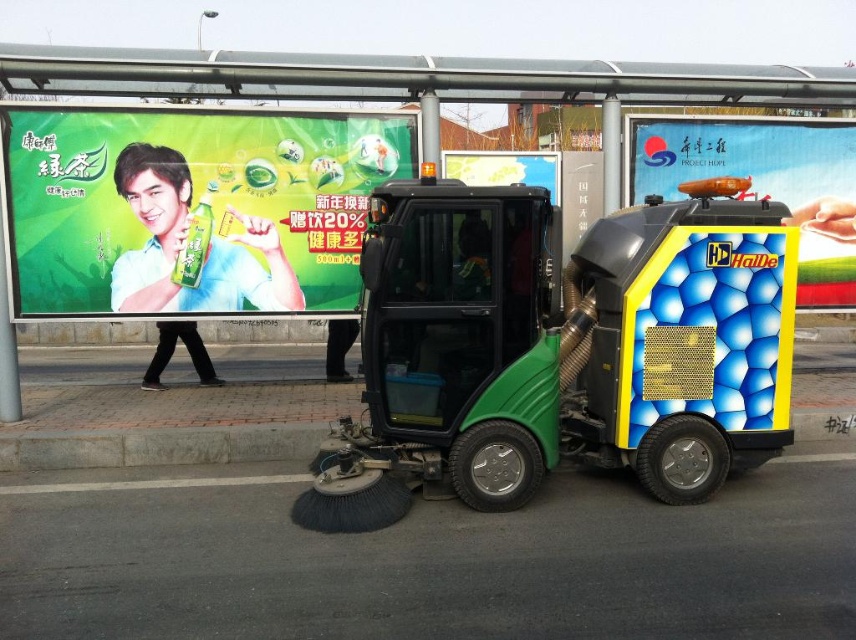
Is green matte bottle at upper left in front of yellow metallic billboard at center?

That is True.

Who is shorter, green matte bottle at upper left or yellow metallic billboard at center?

With less height is yellow metallic billboard at center.

Is point (152, 144) less distant than point (539, 157)?

Yes, it is in front of point (539, 157).

Where is `green matte bottle at upper left`? Image resolution: width=856 pixels, height=640 pixels. green matte bottle at upper left is located at coordinates (192, 205).

Which is below, green matte street sweeper at center or green matte bottle at upper left?

green matte street sweeper at center is below.

Is green matte street sweeper at center positioned in front of green matte bottle at upper left?

Yes.

What do you see at coordinates (563, 344) in the screenshot?
I see `green matte street sweeper at center` at bounding box center [563, 344].

Where is `green matte street sweeper at center`? The height and width of the screenshot is (640, 856). green matte street sweeper at center is located at coordinates (563, 344).

Is smooth green bottle at upper left closer to the viewer compared to black pants at lower left?

Yes, smooth green bottle at upper left is closer to the viewer.

In the scene shown: Can you confirm if smooth green bottle at upper left is shorter than black pants at lower left?

No.

Which is behind, point (245, 241) or point (189, 349)?

Positioned behind is point (189, 349).

Identify the location of smooth green bottle at upper left. Image resolution: width=856 pixels, height=640 pixels. (183, 243).